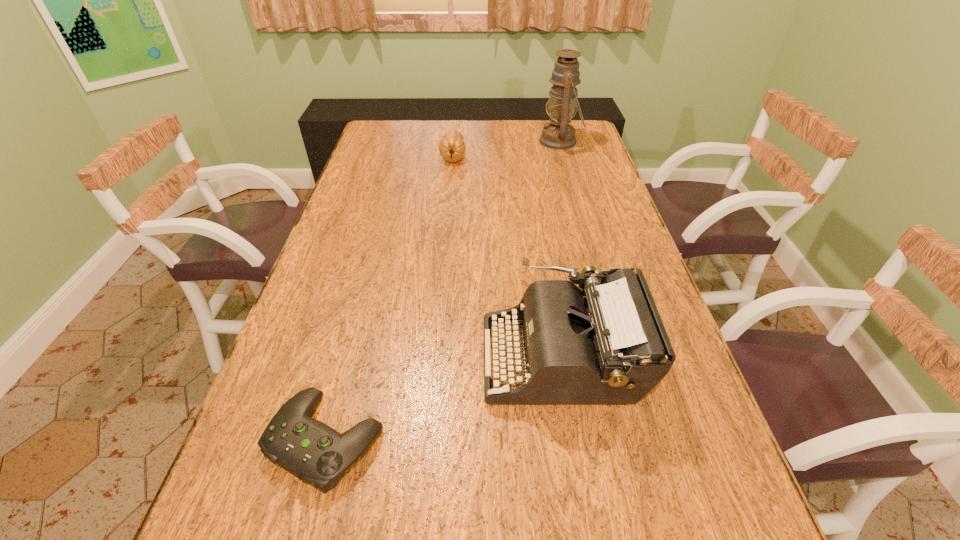
Locate an element on the screen. The image size is (960, 540). free space located on the stem side of the gourd is located at coordinates (446, 232).

The width and height of the screenshot is (960, 540). I want to click on free space located on the right of the control, so click(578, 439).

Image resolution: width=960 pixels, height=540 pixels. I want to click on oil lamp at the far edge, so click(x=559, y=135).

Find the location of a particular element. The width and height of the screenshot is (960, 540). gourd situated at the far edge is located at coordinates [452, 147].

Where is `object present at the left edge`? object present at the left edge is located at coordinates (315, 453).

This screenshot has width=960, height=540. I want to click on oil lamp that is at the right edge, so click(x=559, y=135).

Locate an element on the screen. typewriter that is positioned at the right edge is located at coordinates (605, 344).

Locate an element on the screen. object situated at the far right corner is located at coordinates (559, 135).

The height and width of the screenshot is (540, 960). In order to click on vacant area at the far edge in this screenshot , I will do `click(491, 121)`.

What are the coordinates of `blank space at the left edge` in the screenshot? It's located at (249, 429).